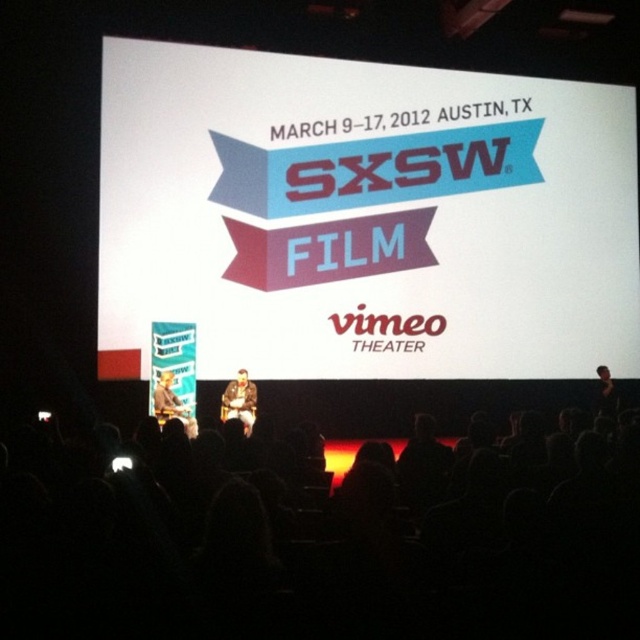
Who is shorter, white paper at center or black fabric at right?

black fabric at right

Is white paper at center smaller than black fabric at right?

No.

What do you see at coordinates (364, 218) in the screenshot? I see `white paper at center` at bounding box center [364, 218].

At what (x,y) coordinates should I click in order to perform the action: click on white paper at center. Please return your answer as a coordinate pair (x, y). The width and height of the screenshot is (640, 640). Looking at the image, I should click on (364, 218).

Who is positioned more to the left, black fabric at lower center or black fabric at right?

Positioned to the left is black fabric at lower center.

Between point (172, 614) and point (596, 376), which one is positioned behind?

The point (596, 376) is more distant.

Is point (12, 468) more distant than point (602, 408)?

No, it is not.

Locate an element on the screen. Image resolution: width=640 pixels, height=640 pixels. black fabric at lower center is located at coordinates (323, 531).

The width and height of the screenshot is (640, 640). In order to click on white paper at center in this screenshot , I will do `click(364, 218)`.

Can you confirm if white paper at center is taller than brown leather jacket at center?

Indeed, white paper at center has a greater height compared to brown leather jacket at center.

I want to click on white paper at center, so click(x=364, y=218).